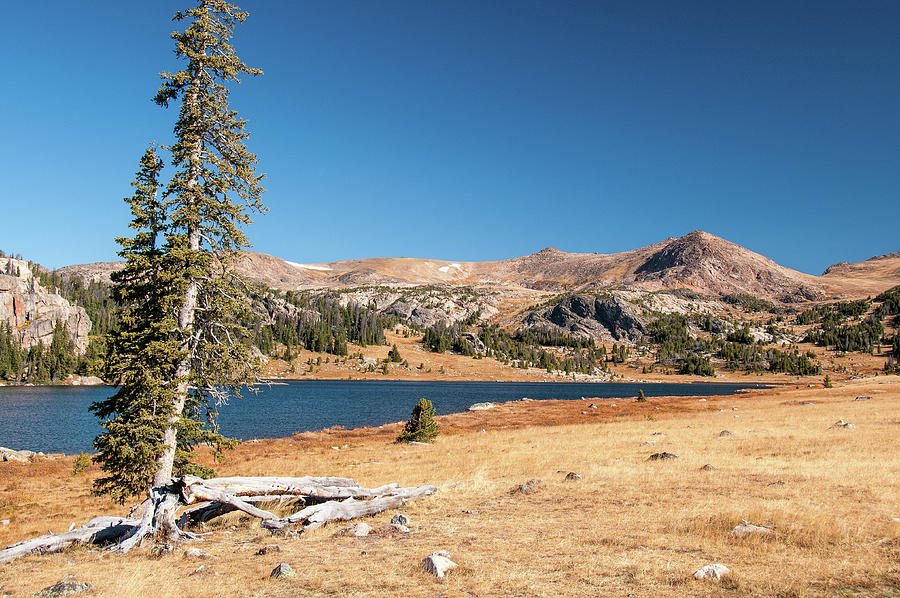
Find the location of a particular element. This screenshot has height=598, width=900. mini tree is located at coordinates (420, 419), (828, 378), (816, 368), (733, 350), (709, 350), (892, 365), (407, 368), (396, 359), (49, 378), (70, 459).